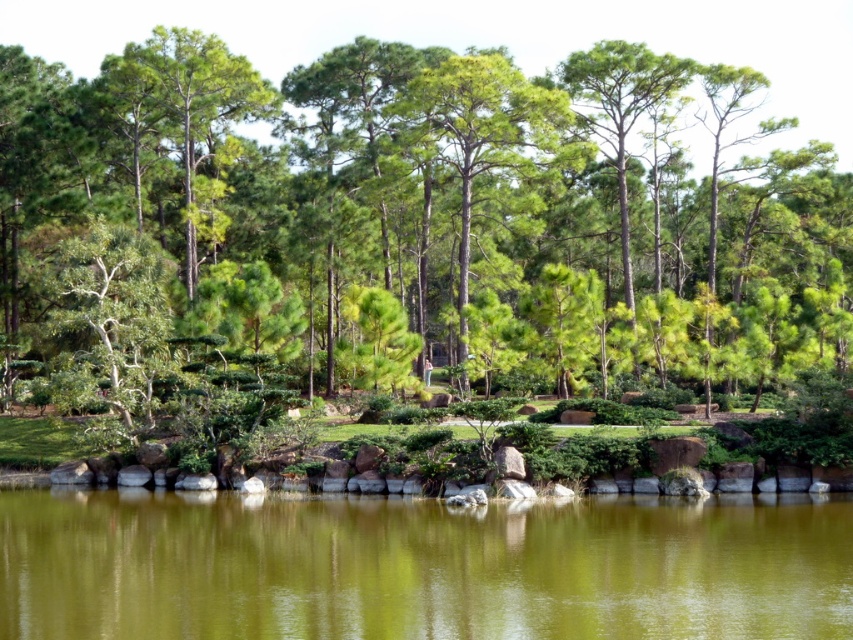
Question: Does green leafy tree at center have a smaller size compared to greenish water at center?

Choices:
 (A) no
 (B) yes

Answer: (A)

Question: Is green leafy tree at center bigger than greenish water at center?

Choices:
 (A) yes
 (B) no

Answer: (A)

Question: Observing the image, what is the correct spatial positioning of green leafy tree at center in reference to greenish water at center?

Choices:
 (A) above
 (B) below

Answer: (A)